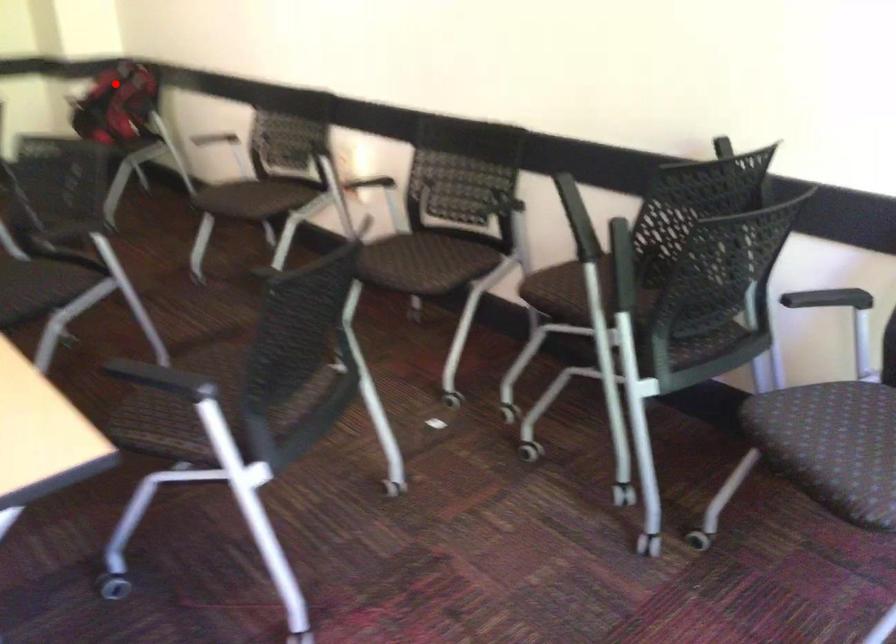
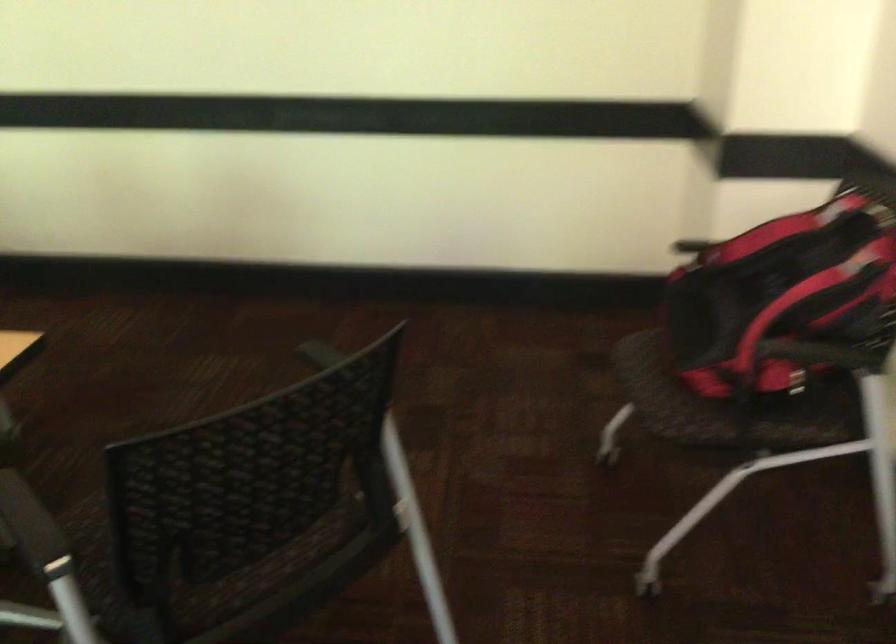
Question: A red point is marked in image1. In image2, is the corresponding 3D point closer to the camera or farther? Reply with the corresponding letter.

Choices:
 (A) The corresponding 3D point is closer.
 (B) The corresponding 3D point is farther.

Answer: (A)